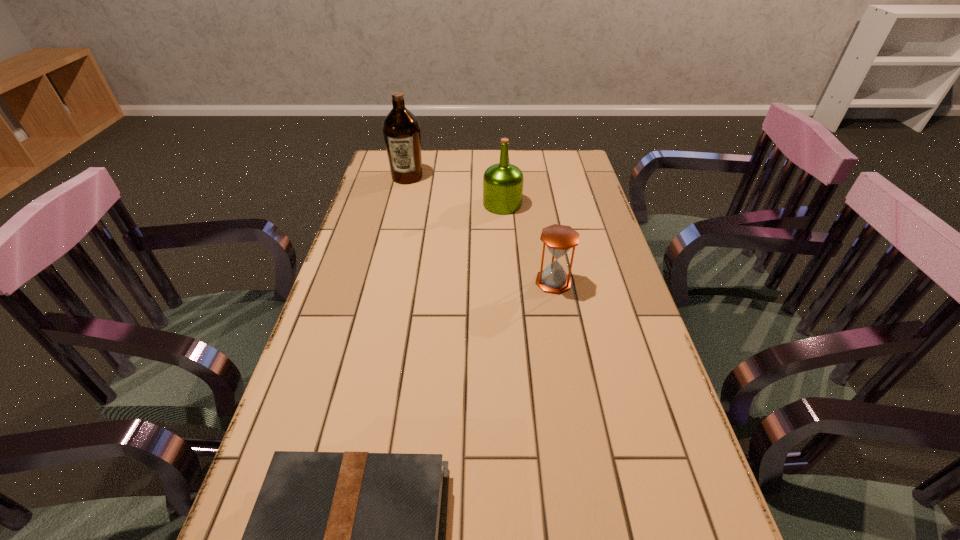
Locate an element on the screen. The image size is (960, 540). free area in between the tallest object and the third tallest object is located at coordinates (480, 230).

Identify the location of free spot between the third farthest object and the farther olive oil. This screenshot has height=540, width=960. (480, 230).

Where is `the second closest object relative to the second tallest object`? the second closest object relative to the second tallest object is located at coordinates (559, 239).

The height and width of the screenshot is (540, 960). Find the location of `the closest object to the third nearest object`. the closest object to the third nearest object is located at coordinates (401, 129).

You are a GUI agent. You are given a task and a screenshot of the screen. Output one action in this format:
    pyautogui.click(x=<x>, y=<y>)
    Task: Click on the blank area in the image that satisfies the following two spatial constraints: 1. on the front side of the second shortest object; 2. on the left side of the third object from left to right
    The height and width of the screenshot is (540, 960).
    Given the screenshot: What is the action you would take?
    pyautogui.click(x=508, y=282)

Identify the location of free space that satisfies the following two spatial constraints: 1. on the front side of the hourglass; 2. on the right side of the second object from right to left. This screenshot has width=960, height=540. (508, 282).

The height and width of the screenshot is (540, 960). In order to click on free location that satisfies the following two spatial constraints: 1. on the label of the rightmost object; 2. on the left side of the farthest object in this screenshot , I will do `click(382, 282)`.

At what (x,y) coordinates should I click in order to perform the action: click on free space in the image that satisfies the following two spatial constraints: 1. on the label of the left olive oil; 2. on the right side of the shorter olive oil. Please return your answer as a coordinate pair (x, y). Looking at the image, I should click on (400, 204).